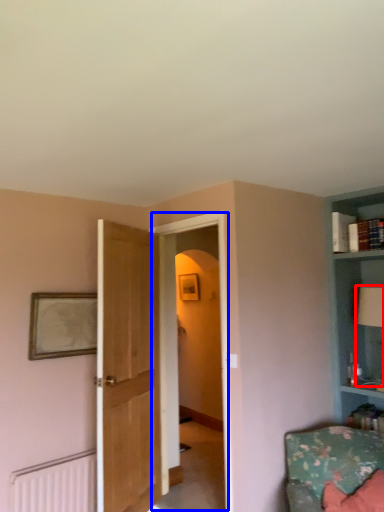
Question: Which object is closer to the camera taking this photo, table lamp (highlighted by a red box) or glass door (highlighted by a blue box)?

Choices:
 (A) table lamp
 (B) glass door

Answer: (B)